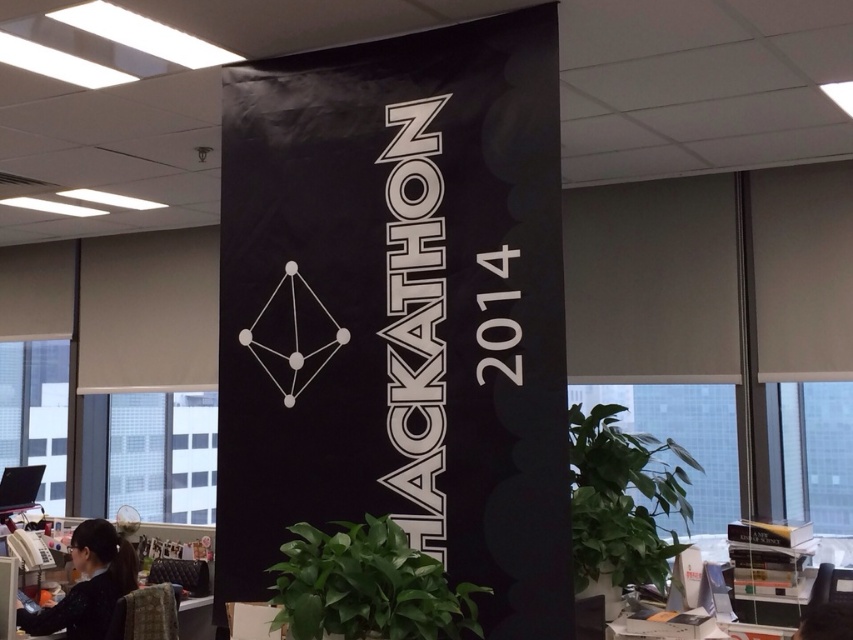
Can you confirm if black matte banner at center is wider than green leafy plant at lower center?

Yes.

Is the position of black matte banner at center more distant than that of green leafy plant at lower center?

Yes, it is.

Locate an element on the screen. black matte banner at center is located at coordinates (399, 310).

Locate an element on the screen. The height and width of the screenshot is (640, 853). black matte banner at center is located at coordinates (399, 310).

Is green leafy plant at lower center positioned before black hair at lower left?

Yes, green leafy plant at lower center is closer to the viewer.

Can you confirm if green leafy plant at lower center is shorter than black hair at lower left?

Yes, green leafy plant at lower center is shorter than black hair at lower left.

Locate an element on the screen. The width and height of the screenshot is (853, 640). green leafy plant at lower center is located at coordinates (367, 586).

Does black matte banner at center have a greater width compared to black hair at lower left?

Indeed, black matte banner at center has a greater width compared to black hair at lower left.

The height and width of the screenshot is (640, 853). In order to click on black matte banner at center in this screenshot , I will do `click(399, 310)`.